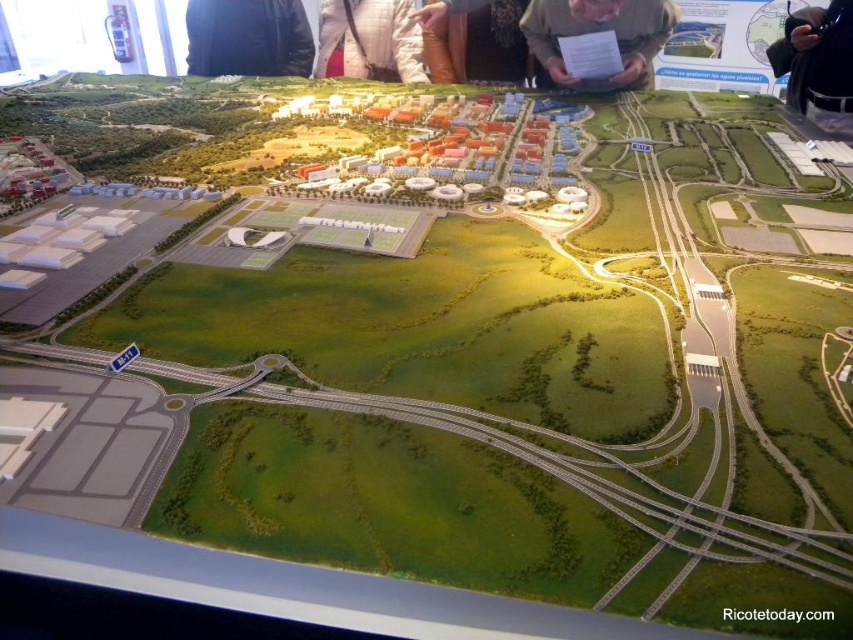
Question: Does matte brown paper at upper center have a smaller size compared to black leather jacket at upper center?

Choices:
 (A) yes
 (B) no

Answer: (B)

Question: Which is farther from the brown leather pants at upper center?

Choices:
 (A) white cotton jacket at upper center
 (B) black leather jacket at upper right

Answer: (B)

Question: Which point is closer to the camera?

Choices:
 (A) matte brown paper at upper center
 (B) white cotton jacket at upper center
 (C) black leather jacket at upper center

Answer: (A)

Question: Is black leather jacket at upper right above white cotton jacket at upper center?

Choices:
 (A) yes
 (B) no

Answer: (B)

Question: Is black leather jacket at upper center to the right of white cotton jacket at upper center from the viewer's perspective?

Choices:
 (A) no
 (B) yes

Answer: (A)

Question: Which of these objects is positioned closest to the black leather jacket at upper center?

Choices:
 (A) black leather jacket at upper right
 (B) matte brown paper at upper center
 (C) white cotton jacket at upper center
 (D) brown leather pants at upper center

Answer: (C)